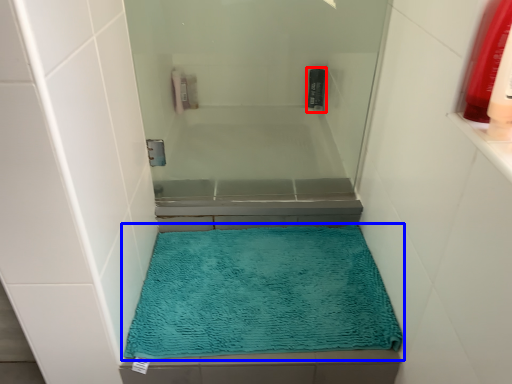
Question: Among these objects, which one is nearest to the camera, mouthwash (highlighted by a red box) or bath mat (highlighted by a blue box)?

Choices:
 (A) mouthwash
 (B) bath mat

Answer: (B)